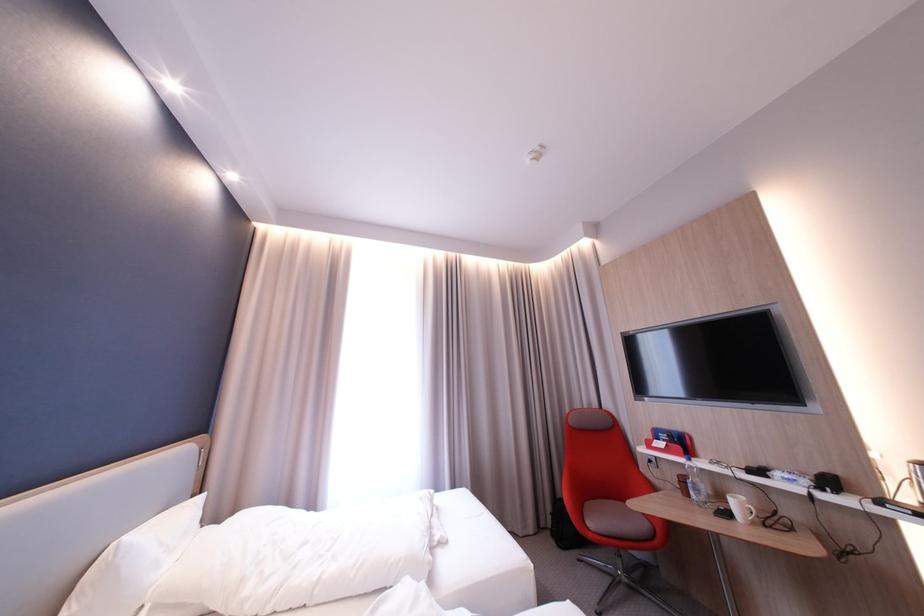
Identify the location of kettle handle. The width and height of the screenshot is (924, 616). (918, 517).